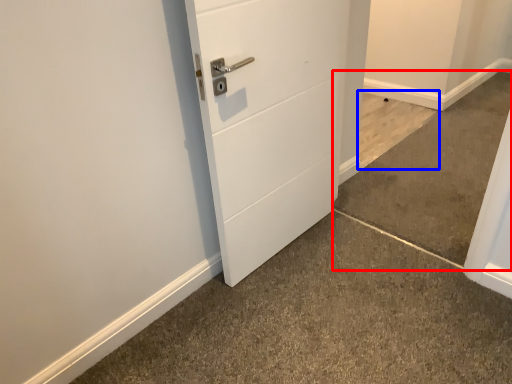
Question: Which point is further to the camera, concrete (highlighted by a red box) or concrete (highlighted by a blue box)?

Choices:
 (A) concrete
 (B) concrete

Answer: (B)